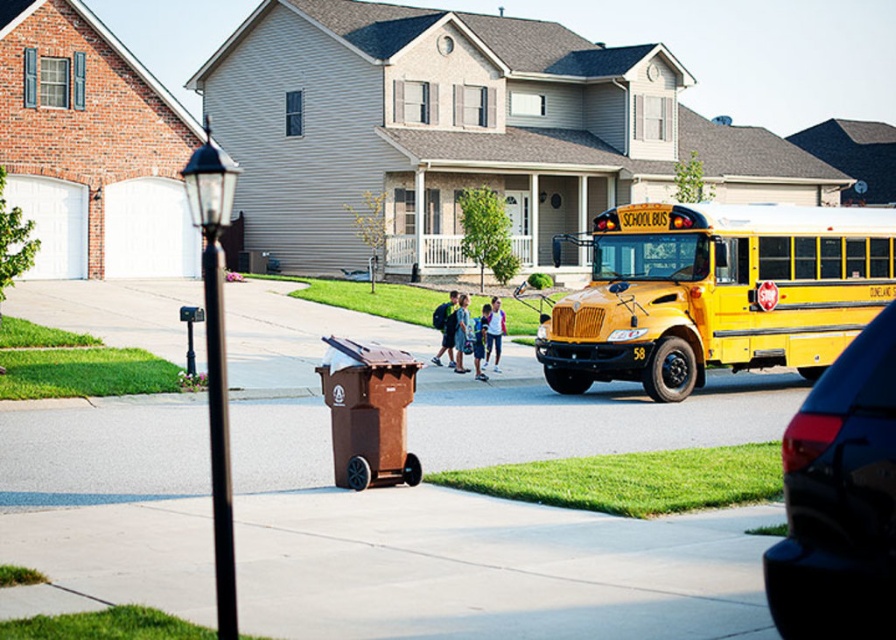
Question: Observing the image, what is the correct spatial positioning of yellow matte/solid school bus at right in reference to glossy black car at lower right?

Choices:
 (A) below
 (B) above

Answer: (B)

Question: Considering the relative positions of yellow matte/solid school bus at right and glossy black car at lower right in the image provided, where is yellow matte/solid school bus at right located with respect to glossy black car at lower right?

Choices:
 (A) left
 (B) right

Answer: (B)

Question: Does yellow matte/solid school bus at right come behind glossy black car at lower right?

Choices:
 (A) yes
 (B) no

Answer: (A)